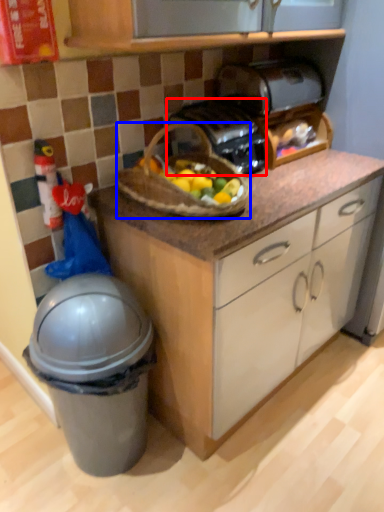
Question: Which object appears closest to the camera in this image, toaster (highlighted by a red box) or picnic basket (highlighted by a blue box)?

Choices:
 (A) toaster
 (B) picnic basket

Answer: (B)